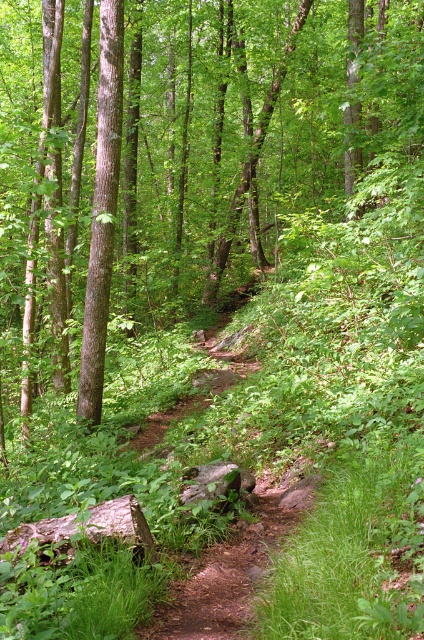
From the picture: You are standing at the starting point of the dirt path in the forest. You notice a green leafy tree marked at point (186, 154). In which direction should you walk to reach the tree?

The green leafy tree at center is marked at point (186, 154), so you should walk towards the center of the image to reach it.

You are a hiker standing on the narrow dirt path in the center of the forest. You notice two trees ahead of you, the green leafy tree at center and the brown smooth tree at left. Which tree has a wider trunk?

The green leafy tree at center has a wider trunk than the brown smooth tree at left.